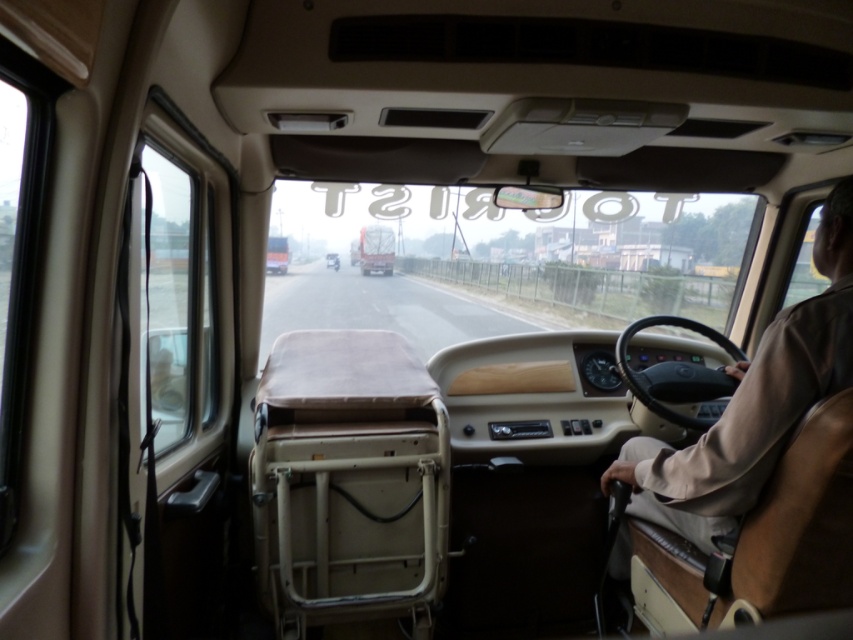
Question: Does beige fabric shirt at right have a larger size compared to metallic silver car at center?

Choices:
 (A) yes
 (B) no

Answer: (A)

Question: Which of the following is the closest to the observer?

Choices:
 (A) beige fabric shirt at right
 (B) metallic silver car at center

Answer: (A)

Question: Can you confirm if beige fabric shirt at right is positioned to the right of metallic silver car at center?

Choices:
 (A) yes
 (B) no

Answer: (A)

Question: Does beige fabric shirt at right appear on the right side of metallic silver car at center?

Choices:
 (A) no
 (B) yes

Answer: (B)

Question: Which point is closer to the camera taking this photo?

Choices:
 (A) (334, 268)
 (B) (747, 461)

Answer: (B)